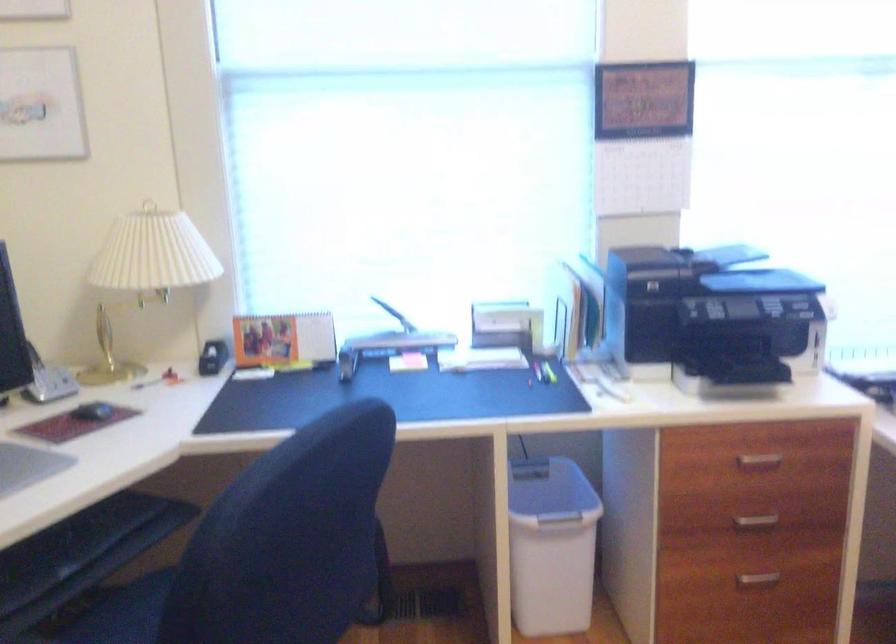
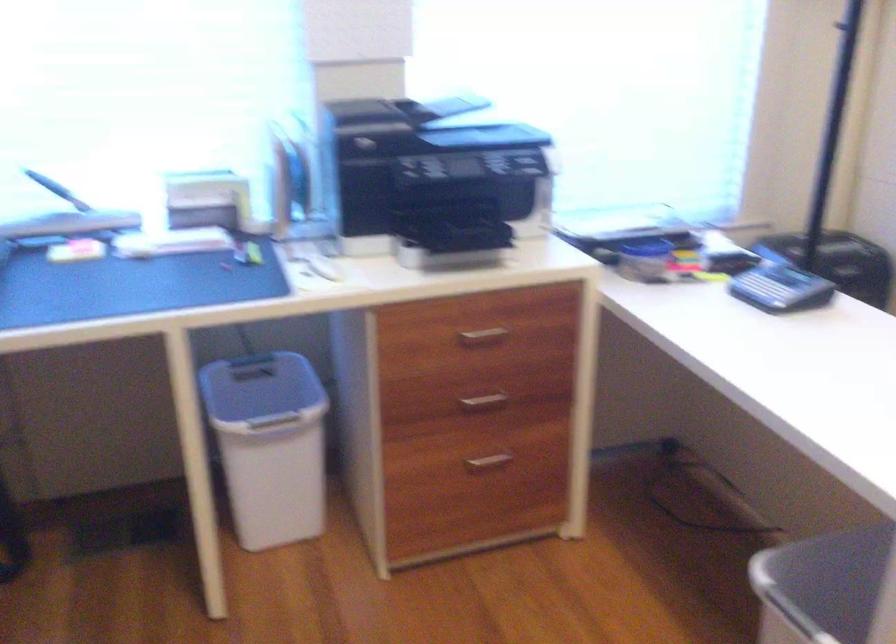
Where in the second image is the point corresponding to pixel 538 491 from the first image?

(261, 390)